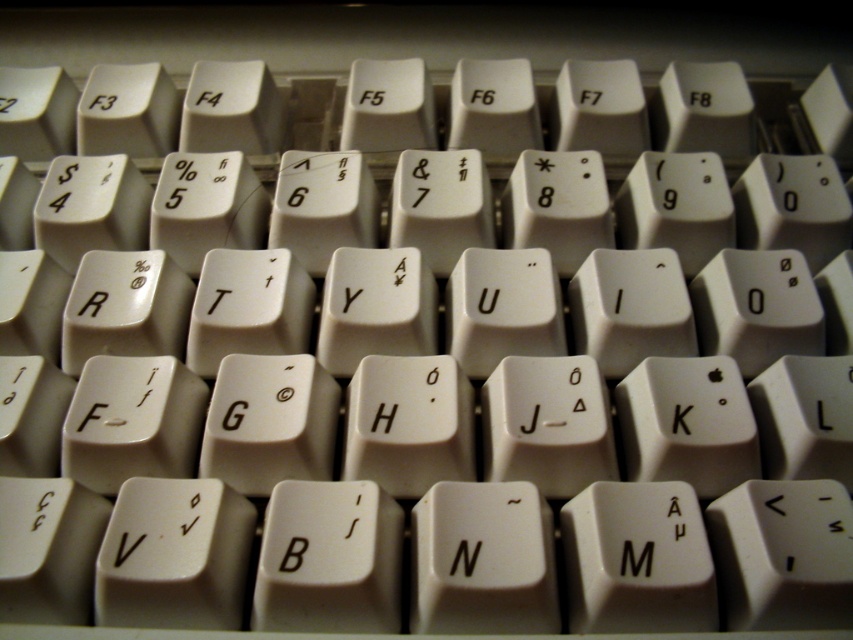
You are designing a keyboard layout and need to ensure that all keys are of equal height. You observe the white plastic letter n at center and the white plastic letter h at center. Which key violates the requirement?

The white plastic letter h at center violates the requirement because it has a greater height than the white plastic letter n at center.